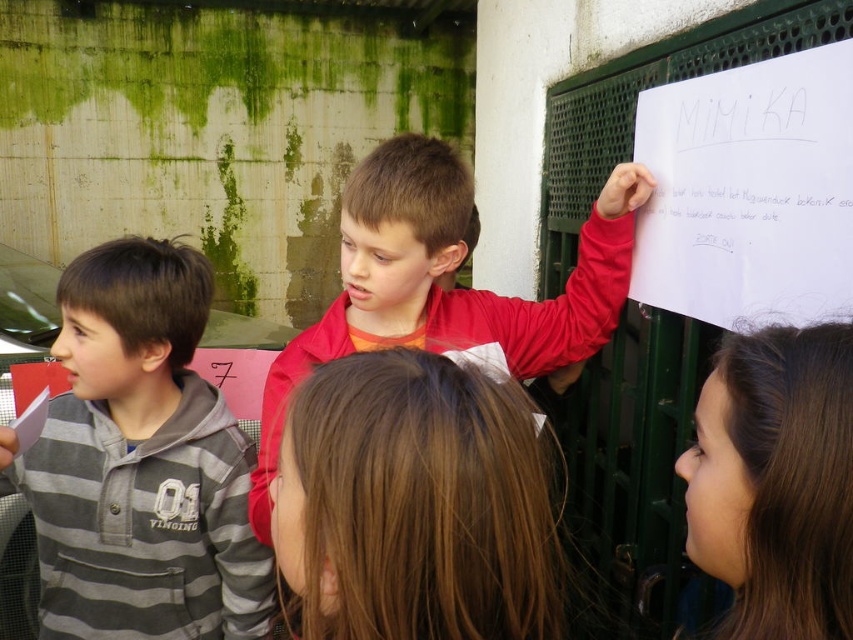
Which of these two, red matte jacket at center or brown hair at upper right, stands shorter?

Standing shorter between the two is brown hair at upper right.

Does red matte jacket at center appear on the left side of brown hair at upper right?

Indeed, red matte jacket at center is positioned on the left side of brown hair at upper right.

The image size is (853, 640). In order to click on red matte jacket at center in this screenshot , I will do `click(444, 289)`.

Is gray striped hoodie at left wider than brown hair at upper right?

Yes.

Can you confirm if gray striped hoodie at left is bigger than brown hair at upper right?

Yes, gray striped hoodie at left is bigger than brown hair at upper right.

This screenshot has width=853, height=640. In order to click on gray striped hoodie at left in this screenshot , I will do `click(140, 461)`.

The image size is (853, 640). What do you see at coordinates (140, 461) in the screenshot?
I see `gray striped hoodie at left` at bounding box center [140, 461].

Which is in front, point (152, 339) or point (407, 314)?

Point (152, 339) is in front.

In order to click on gray striped hoodie at left in this screenshot , I will do `click(140, 461)`.